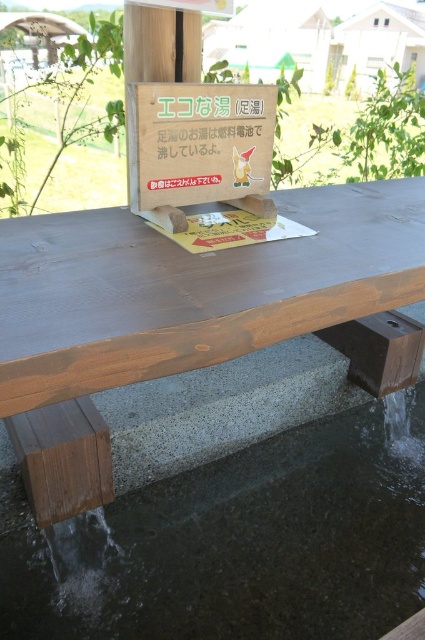
Which is more to the right, clear concrete water at lower center or stained wood picnic table at center?

clear concrete water at lower center is more to the right.

Who is positioned more to the left, clear concrete water at lower center or stained wood picnic table at center?

stained wood picnic table at center

Which is behind, point (147, 513) or point (357, 259)?

The point (147, 513) is behind.

At what (x,y) coordinates should I click in order to perform the action: click on clear concrete water at lower center. Please return your answer as a coordinate pair (x, y). Looking at the image, I should click on (241, 544).